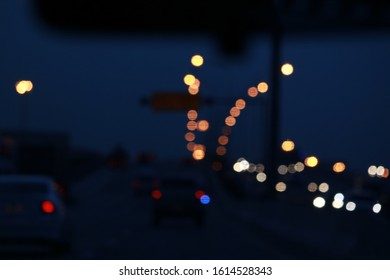
Where is `light`? light is located at coordinates (198, 192).